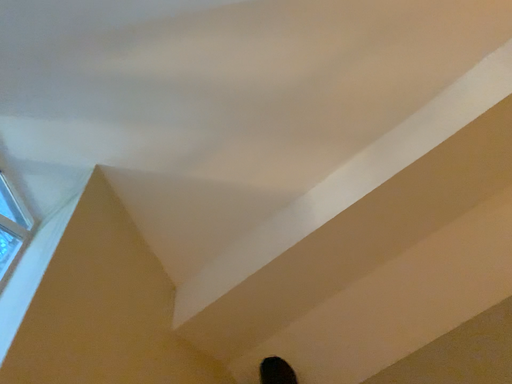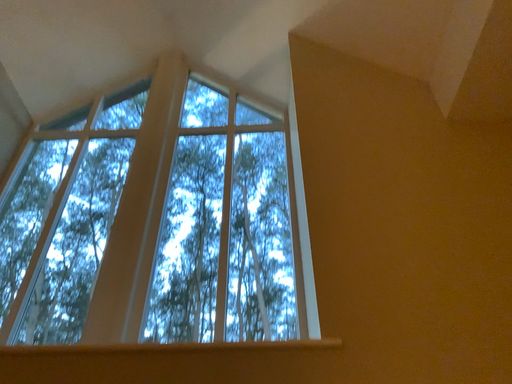
Question: How did the camera likely rotate when shooting the video?

Choices:
 (A) rotated upward
 (B) rotated downward

Answer: (B)